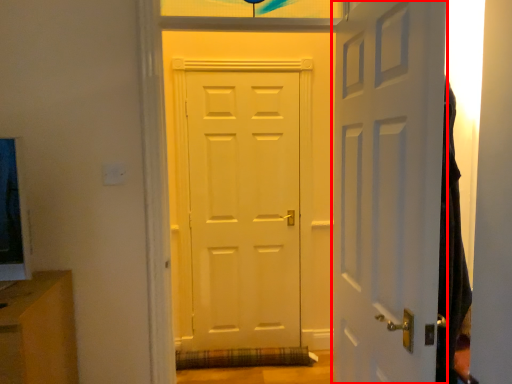
Question: Observing the image, what is the correct spatial positioning of door (annotated by the red box) in reference to door?

Choices:
 (A) right
 (B) left

Answer: (A)